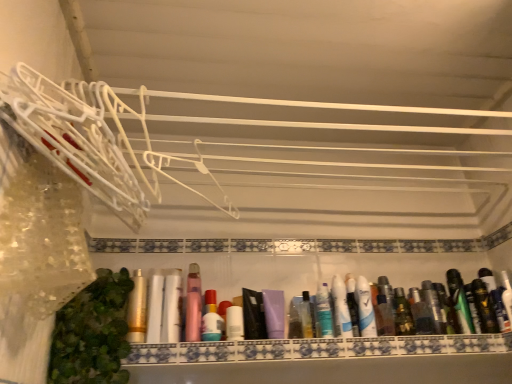
Question: Can you confirm if matte plastic bottles at center is taller than matte black deodorant at center right, marked as the second toiletry in a right-to-left arrangement?

Choices:
 (A) no
 (B) yes

Answer: (A)

Question: Would you say matte plastic bottles at center is a long distance from matte black deodorant at center right, marked as the second toiletry in a right-to-left arrangement?

Choices:
 (A) yes
 (B) no

Answer: (B)

Question: Is matte plastic bottles at center outside matte black deodorant at center right, the 16th toiletry in the left-to-right sequence?

Choices:
 (A) yes
 (B) no

Answer: (A)

Question: From the image's perspective, is matte plastic bottles at center over matte black deodorant at center right, marked as the second toiletry in a right-to-left arrangement?

Choices:
 (A) no
 (B) yes

Answer: (A)

Question: Could you tell me if matte plastic bottles at center is facing matte black deodorant at center right, the 16th toiletry in the left-to-right sequence?

Choices:
 (A) no
 (B) yes

Answer: (A)

Question: Considering the relative positions of metallic silver spray can at center right, positioned as the 12th toiletry in left-to-right order, and shiny black tube at right, which ranks as the 15th toiletry in left-to-right order, in the image provided, is metallic silver spray can at center right, positioned as the 12th toiletry in left-to-right order, to the left or to the right of shiny black tube at right, which ranks as the 15th toiletry in left-to-right order,?

Choices:
 (A) left
 (B) right

Answer: (A)

Question: From the image's perspective, is metallic silver spray can at center right, acting as the sixth toiletry starting from the right, located above or below shiny black tube at right, the 3th toiletry positioned from the right?

Choices:
 (A) above
 (B) below

Answer: (B)

Question: In terms of width, does metallic silver spray can at center right, positioned as the 12th toiletry in left-to-right order, look wider or thinner when compared to shiny black tube at right, which ranks as the 15th toiletry in left-to-right order?

Choices:
 (A) wide
 (B) thin

Answer: (A)

Question: Considering the positions of point (437, 331) and point (487, 319), is point (437, 331) closer or farther from the camera than point (487, 319)?

Choices:
 (A) farther
 (B) closer

Answer: (A)

Question: Considering the positions of point pyautogui.click(x=372, y=311) and point pyautogui.click(x=330, y=350), is point pyautogui.click(x=372, y=311) closer or farther from the camera than point pyautogui.click(x=330, y=350)?

Choices:
 (A) farther
 (B) closer

Answer: (A)

Question: In terms of width, does white glossy tube at center, arranged as the 2th toothpaste when viewed from the left, look wider or thinner when compared to matte plastic bottles at center?

Choices:
 (A) thin
 (B) wide

Answer: (A)

Question: Based on their sizes in the image, would you say white glossy tube at center, which is the 1th toothpaste from right to left, is bigger or smaller than matte plastic bottles at center?

Choices:
 (A) small
 (B) big

Answer: (A)

Question: Considering the relative positions of white glossy tube at center, arranged as the 2th toothpaste when viewed from the left, and matte plastic bottles at center in the image provided, is white glossy tube at center, arranged as the 2th toothpaste when viewed from the left, to the left or to the right of matte plastic bottles at center?

Choices:
 (A) left
 (B) right

Answer: (B)

Question: Is shiny metallic spray can at center, which is counted as the 9th toiletry, starting from the right, bigger or smaller than green matte deodorant at right, the 4th toiletry when ordered from right to left?

Choices:
 (A) small
 (B) big

Answer: (B)

Question: From their relative heights in the image, would you say shiny metallic spray can at center, which is counted as the 9th toiletry, starting from the right, is taller or shorter than green matte deodorant at right, marked as the fourteenth toiletry in a left-to-right arrangement?

Choices:
 (A) short
 (B) tall

Answer: (A)